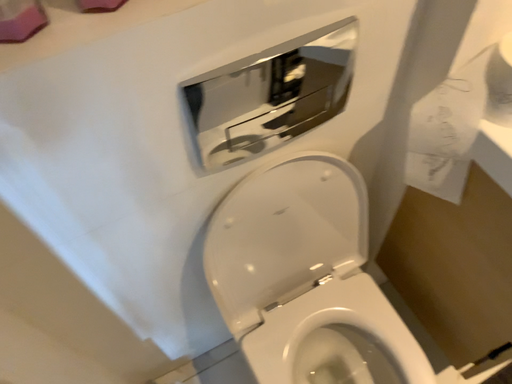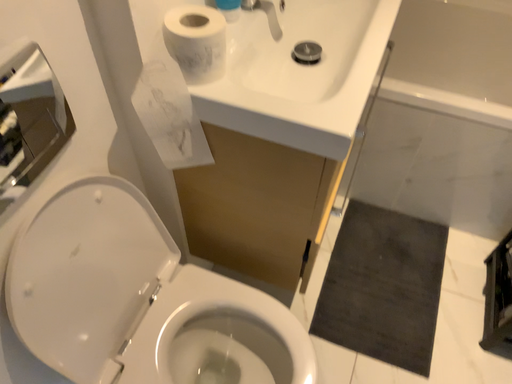
Question: How did the camera likely rotate when shooting the video?

Choices:
 (A) rotated right
 (B) rotated left

Answer: (A)